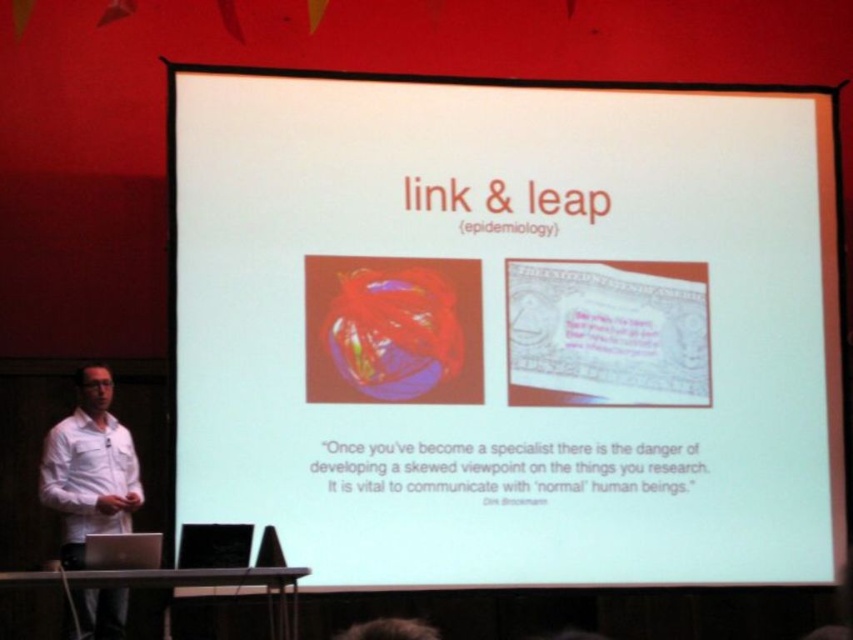
Question: Among these points, which one is nearest to the camera?

Choices:
 (A) (463, 568)
 (B) (97, 632)

Answer: (B)

Question: Is white paper at center thinner than white shirt at left?

Choices:
 (A) no
 (B) yes

Answer: (A)

Question: Among these objects, which one is nearest to the camera?

Choices:
 (A) white paper at center
 (B) white shirt at left

Answer: (B)

Question: Does white paper at center have a greater width compared to white shirt at left?

Choices:
 (A) no
 (B) yes

Answer: (B)

Question: Which object appears closest to the camera in this image?

Choices:
 (A) white paper at center
 (B) white shirt at left

Answer: (B)

Question: Is white paper at center above white shirt at left?

Choices:
 (A) yes
 (B) no

Answer: (A)